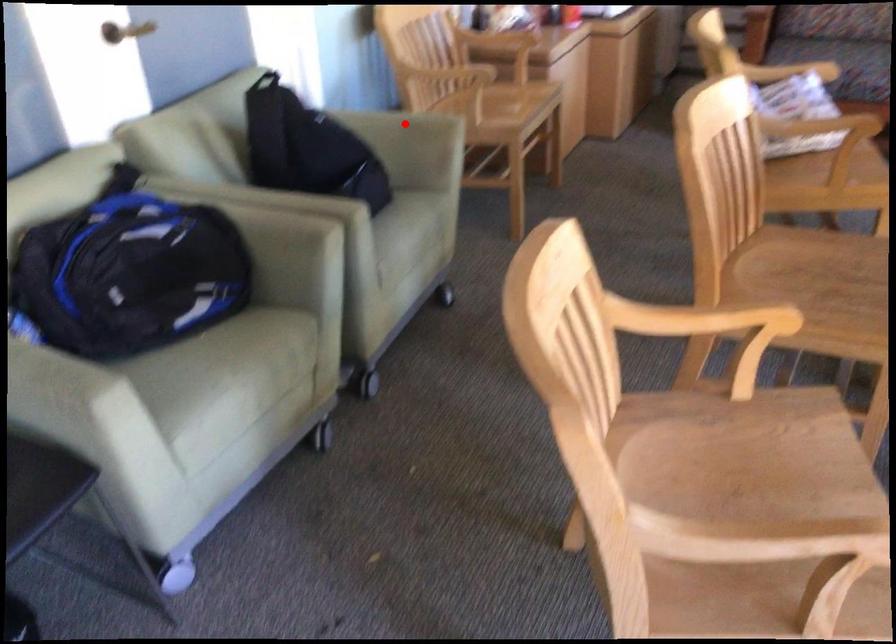
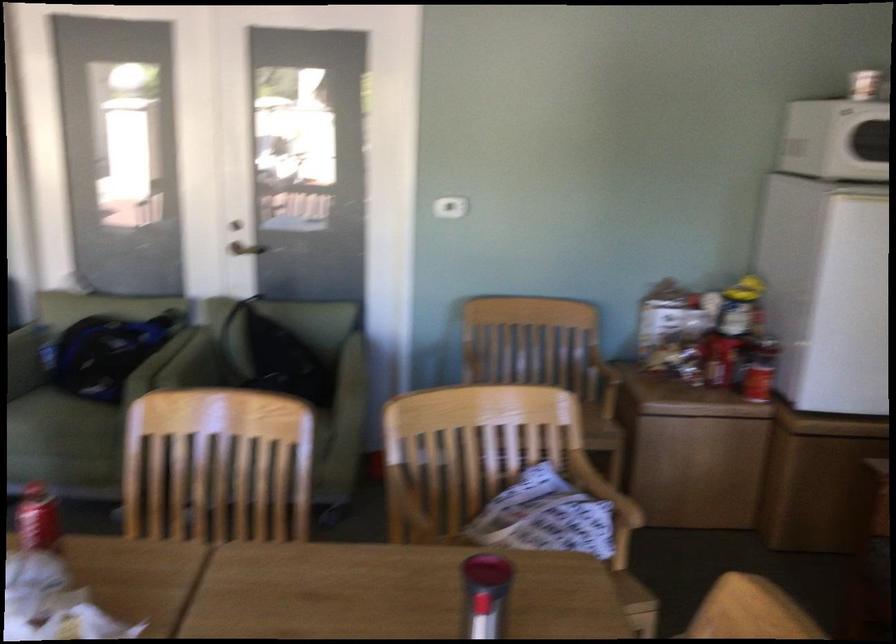
Question: I am providing you with two images of the same scene from different viewpoints. A red point is marked on the first image. At the location where the point appears in image 1, is it still visible in image 2?

Choices:
 (A) Yes
 (B) No

Answer: (B)